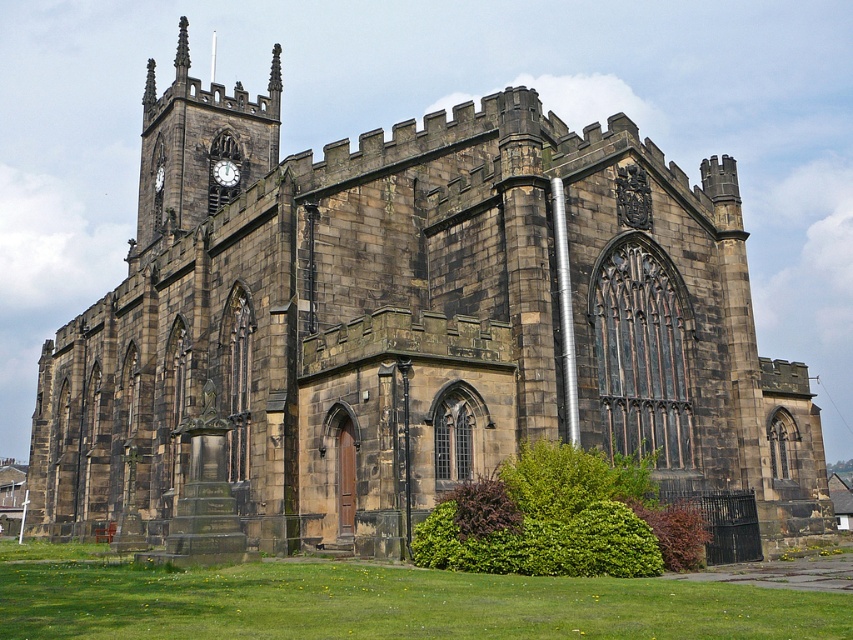
Question: Which of the following is the farthest from the observer?

Choices:
 (A) green leafy bush at lower center
 (B) matte black clock at upper left

Answer: (B)

Question: Can you confirm if green leafy bush at lower center is positioned to the right of matte black clock at upper left?

Choices:
 (A) no
 (B) yes

Answer: (B)

Question: Which point is closer to the camera?

Choices:
 (A) (641, 493)
 (B) (230, 166)

Answer: (A)

Question: Which point is farther to the camera?

Choices:
 (A) green leafy bush at lower center
 (B) matte black clock at upper left

Answer: (B)

Question: Does green leafy bush at lower center appear under matte black clock at upper left?

Choices:
 (A) yes
 (B) no

Answer: (A)

Question: Is green leafy bush at lower center thinner than matte black clock at upper left?

Choices:
 (A) no
 (B) yes

Answer: (A)